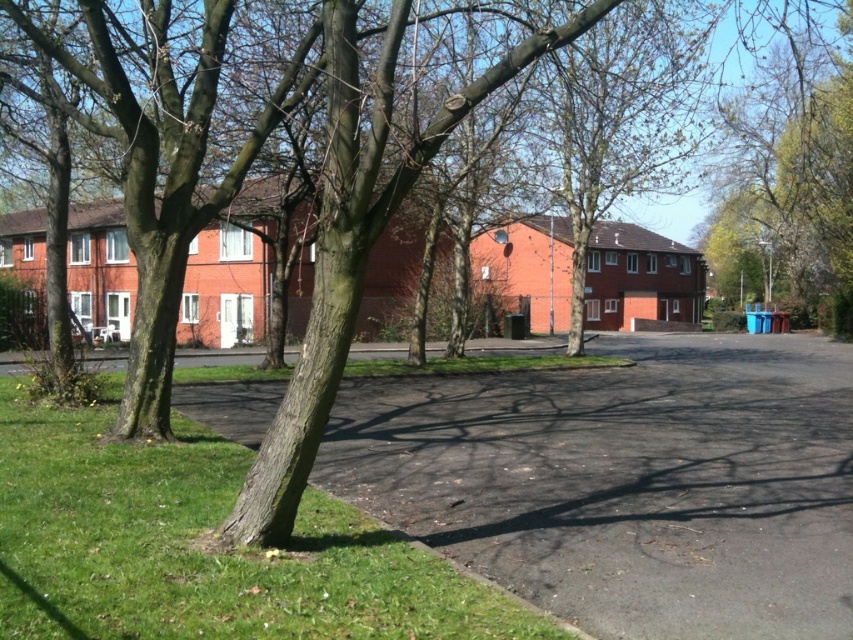
How much distance is there between green grass at lower left and green leafy tree at right?

A distance of 42.08 meters exists between green grass at lower left and green leafy tree at right.

At what (x,y) coordinates should I click in order to perform the action: click on green grass at lower left. Please return your answer as a coordinate pair (x, y). Image resolution: width=853 pixels, height=640 pixels. Looking at the image, I should click on (200, 552).

Which is behind, point (51, 531) or point (763, 112)?

Point (763, 112)

Find the location of a particular element. The height and width of the screenshot is (640, 853). green grass at lower left is located at coordinates (200, 552).